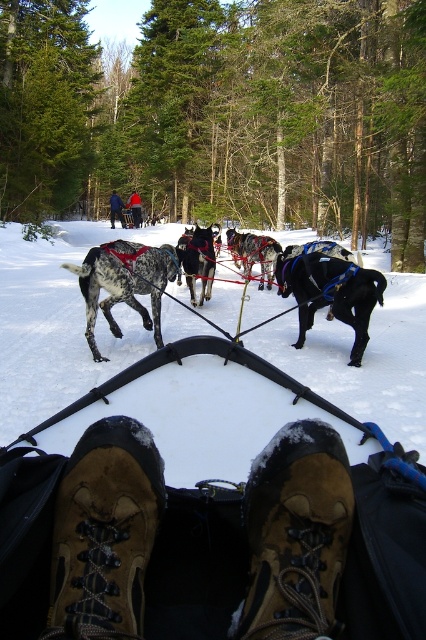
Does blue fabric jacket at upper center appear on the right side of brushed metal backpack at upper center?

In fact, blue fabric jacket at upper center is to the left of brushed metal backpack at upper center.

Is blue fabric jacket at upper center smaller than brushed metal backpack at upper center?

Correct, blue fabric jacket at upper center occupies less space than brushed metal backpack at upper center.

What do you see at coordinates (115, 209) in the screenshot? I see `blue fabric jacket at upper center` at bounding box center [115, 209].

At what (x,y) coordinates should I click in order to perform the action: click on blue fabric jacket at upper center. Please return your answer as a coordinate pair (x, y). The image size is (426, 640). Looking at the image, I should click on (115, 209).

Consider the image. Does white snow at center appear under blue fabric jacket at upper center?

Yes, white snow at center is below blue fabric jacket at upper center.

Does white snow at center come in front of blue fabric jacket at upper center?

Yes, it is.

Does point (149, 232) come farther from viewer compared to point (112, 193)?

No, it is not.

The width and height of the screenshot is (426, 640). Identify the location of white snow at center. (57, 323).

Is the position of white snow at center more distant than that of brushed metal backpack at upper center?

No.

Is white snow at center taller than brushed metal backpack at upper center?

Yes, white snow at center is taller than brushed metal backpack at upper center.

What do you see at coordinates (57, 323) in the screenshot?
I see `white snow at center` at bounding box center [57, 323].

This screenshot has height=640, width=426. In order to click on white snow at center in this screenshot , I will do (57, 323).